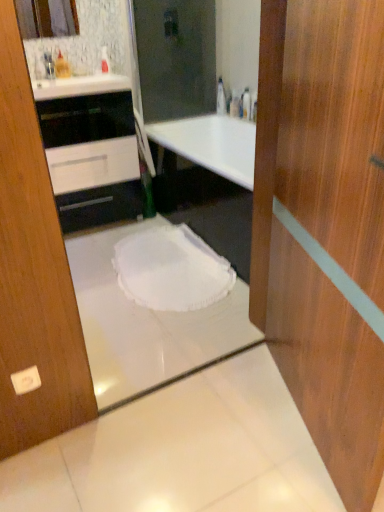
This screenshot has width=384, height=512. In order to click on free location above white fabric bath at center (from a real-world perspective) in this screenshot , I will do `click(162, 269)`.